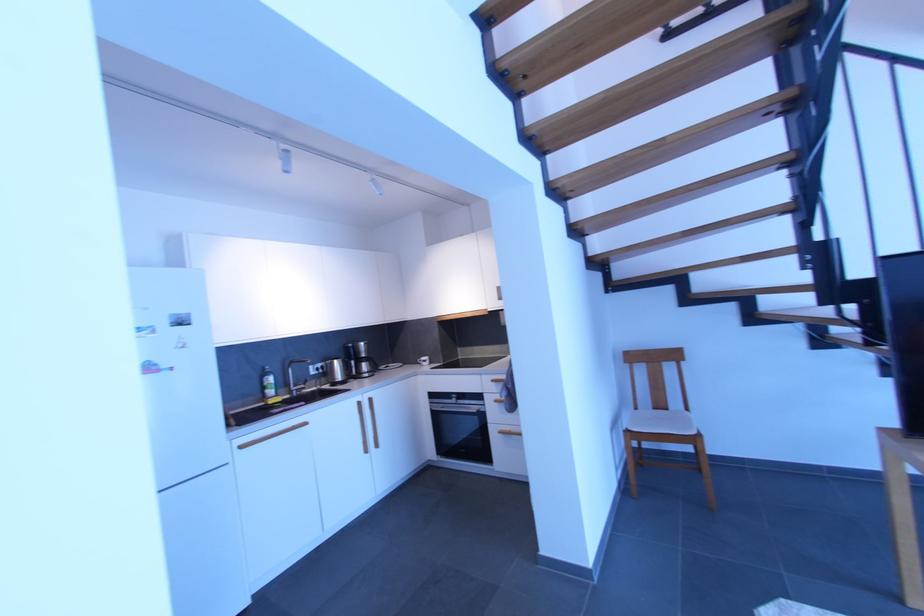
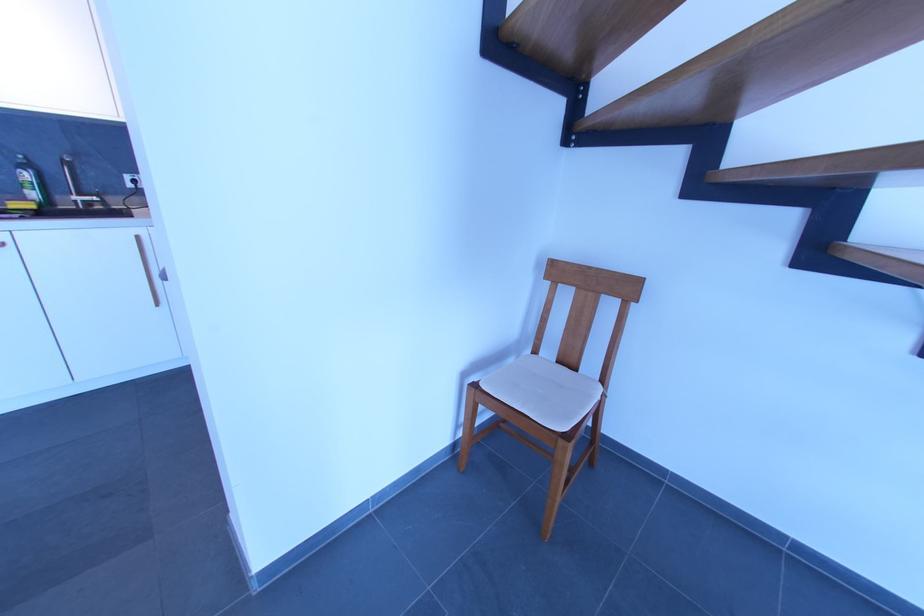
What movement of the cameraman would produce the second image?

The cameraman walked toward right, forward.